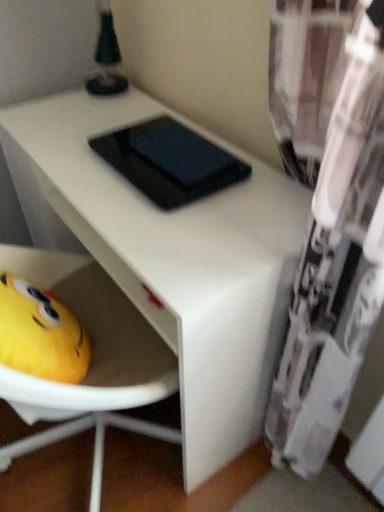
Where is `blank space to the left of black matte pad at center`? This screenshot has height=512, width=384. blank space to the left of black matte pad at center is located at coordinates (74, 154).